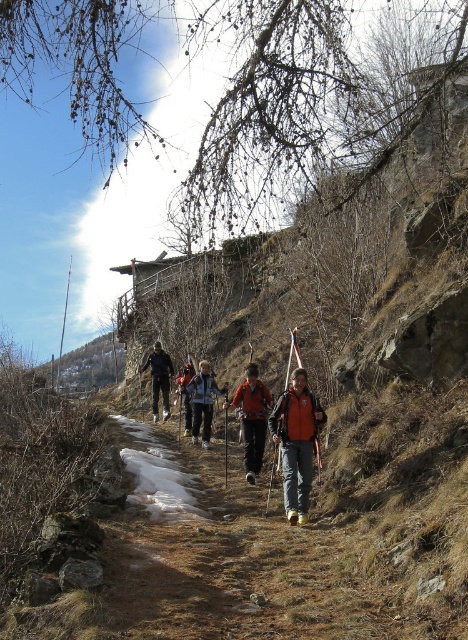
From the picture: You are a hiker on the trail and notice two hikers wearing jackets. One is wearing a black fabric jacket at center and the other an orange fabric jacket at center. From your perspective, which jacket is positioned to the left?

The black fabric jacket at center is positioned to the left of the orange fabric jacket at center.

You are a hiker on the trail and notice a black fabric jacket at center. Where exactly is it located in terms of coordinates?

The black fabric jacket at center is located at coordinates point [159,378].